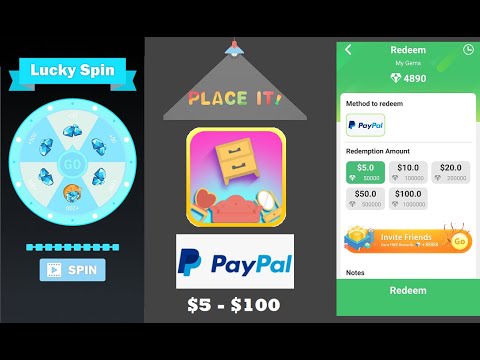
Find the location of `upper drawer`. upper drawer is located at coordinates (224, 153).